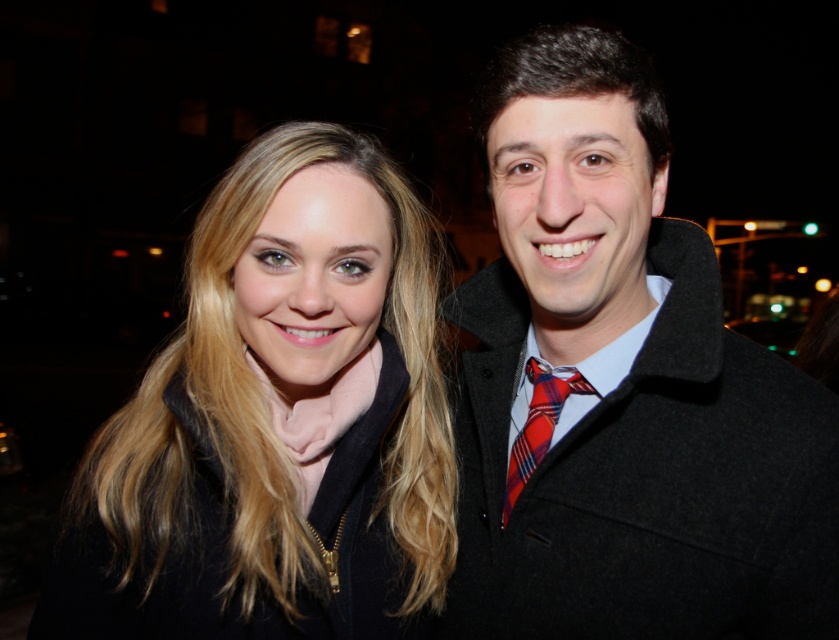
Does matte black coat at right have a smaller size compared to matte black coat at center?

Yes.

Can you confirm if matte black coat at right is positioned above matte black coat at center?

Yes.

Who is more distant from viewer, (830,636) or (263,545)?

The point (830,636) is behind.

Find the location of a particular element. matte black coat at right is located at coordinates (621, 388).

Is matte black coat at right below plaid fabric tie at right?

No.

In the scene shown: Who is higher up, matte black coat at right or plaid fabric tie at right?

matte black coat at right

The width and height of the screenshot is (839, 640). I want to click on matte black coat at right, so click(621, 388).

I want to click on matte black coat at right, so pos(621,388).

Does matte black coat at center have a larger size compared to plaid fabric tie at right?

Yes, matte black coat at center is bigger than plaid fabric tie at right.

Between matte black coat at center and plaid fabric tie at right, which one has more height?

Standing taller between the two is matte black coat at center.

Between point (383, 259) and point (551, 385), which one is positioned behind?

The point (551, 385) is behind.

At what (x,y) coordinates should I click in order to perform the action: click on matte black coat at center. Please return your answer as a coordinate pair (x, y). This screenshot has height=640, width=839. Looking at the image, I should click on (x=277, y=420).